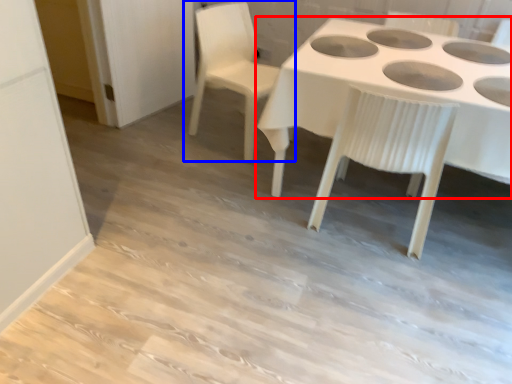
Question: Which object is closer to the camera taking this photo, table (highlighted by a red box) or chair (highlighted by a blue box)?

Choices:
 (A) table
 (B) chair

Answer: (A)